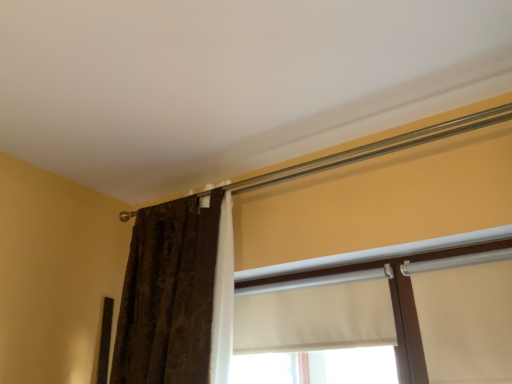
What do you see at coordinates (393, 318) in the screenshot? I see `white fabric at center, the 1th window positioned from the right` at bounding box center [393, 318].

Identify the location of white matte window at center, which is counted as the second window, starting from the right. This screenshot has width=512, height=384. (315, 331).

Locate an element on the screen. The height and width of the screenshot is (384, 512). brown textured curtain at left is located at coordinates (169, 295).

Where is `curtain above the white fabric at center, the 1th window positioned from the right (from the image's perspective)`? This screenshot has width=512, height=384. curtain above the white fabric at center, the 1th window positioned from the right (from the image's perspective) is located at coordinates (169, 295).

From the image's perspective, is white fabric at center, the 1th window positioned from the right, under brown textured curtain at left?

Yes, from the image's perspective, white fabric at center, the 1th window positioned from the right, is beneath brown textured curtain at left.

Which object is thinner, white fabric at center, the 1th window positioned from the right, or brown textured curtain at left?

white fabric at center, the 1th window positioned from the right, is thinner.

Would you say white fabric at center, the second window positioned from the left, contains brown textured curtain at left?

That's incorrect, brown textured curtain at left is not inside white fabric at center, the second window positioned from the left.

From the image's perspective, relative to brown textured curtain at left, is white matte window at center, which is counted as the second window, starting from the right, above or below?

Clearly, from the image's perspective, white matte window at center, which is counted as the second window, starting from the right, is below brown textured curtain at left.

Between white matte window at center, which is counted as the second window, starting from the right, and brown textured curtain at left, which one appears on the right side from the viewer's perspective?

white matte window at center, which is counted as the second window, starting from the right, is more to the right.

Is the depth of white matte window at center, marked as the 1th window in a left-to-right arrangement, greater than that of brown textured curtain at left?

Yes.

How much distance is there between white matte window at center, marked as the 1th window in a left-to-right arrangement, and brown textured curtain at left?

They are 14.05 inches apart.

From a real-world perspective, is white fabric at center, the 1th window positioned from the right, located beneath white matte window at center, marked as the 1th window in a left-to-right arrangement?

Yes, from a real-world perspective, white fabric at center, the 1th window positioned from the right, is beneath white matte window at center, marked as the 1th window in a left-to-right arrangement.

Is white fabric at center, the 1th window positioned from the right, far from white matte window at center, which is counted as the second window, starting from the right?

white fabric at center, the 1th window positioned from the right, is near white matte window at center, which is counted as the second window, starting from the right, not far away.

Which object is closer to the camera taking this photo, white fabric at center, the second window positioned from the left, or white matte window at center, which is counted as the second window, starting from the right?

white fabric at center, the second window positioned from the left, is in front.

Can you tell me how much white fabric at center, the second window positioned from the left, and white matte window at center, marked as the 1th window in a left-to-right arrangement, differ in facing direction?

The angle between the facing direction of white fabric at center, the second window positioned from the left, and the facing direction of white matte window at center, marked as the 1th window in a left-to-right arrangement, is 1.13 degrees.

From a real-world perspective, which is physically below, brown textured curtain at left or white matte window at center, which is counted as the second window, starting from the right?

white matte window at center, which is counted as the second window, starting from the right, is physically lower.

Which object is positioned more to the left, brown textured curtain at left or white matte window at center, which is counted as the second window, starting from the right?

brown textured curtain at left.

Looking at the image, does brown textured curtain at left seem bigger or smaller compared to white matte window at center, which is counted as the second window, starting from the right?

In the image, brown textured curtain at left appears to be larger than white matte window at center, which is counted as the second window, starting from the right.

How much distance is there between brown textured curtain at left and white matte window at center, which is counted as the second window, starting from the right?

brown textured curtain at left is 14.05 inches from white matte window at center, which is counted as the second window, starting from the right.

Considering the positions of points (141, 322) and (500, 260), is point (141, 322) closer to camera compared to point (500, 260)?

No.

Is brown textured curtain at left facing away from white fabric at center, the second window positioned from the left?

brown textured curtain at left does not have its back to white fabric at center, the second window positioned from the left.

Is brown textured curtain at left not inside white fabric at center, the second window positioned from the left?

Absolutely, brown textured curtain at left is external to white fabric at center, the second window positioned from the left.

Looking at this image, measure the distance from brown textured curtain at left to white fabric at center, the 1th window positioned from the right.

Result: The distance of brown textured curtain at left from white fabric at center, the 1th window positioned from the right, is 17.25 inches.

From the image's perspective, which one is positioned lower, white matte window at center, marked as the 1th window in a left-to-right arrangement, or white fabric at center, the 1th window positioned from the right?

white matte window at center, marked as the 1th window in a left-to-right arrangement, from the image's perspective.

Can you see white matte window at center, which is counted as the second window, starting from the right, touching white fabric at center, the second window positioned from the left?

Yes, white matte window at center, which is counted as the second window, starting from the right, and white fabric at center, the second window positioned from the left, clearly make contact.

Is white matte window at center, marked as the 1th window in a left-to-right arrangement, bigger or smaller than white fabric at center, the 1th window positioned from the right?

Clearly, white matte window at center, marked as the 1th window in a left-to-right arrangement, is smaller in size than white fabric at center, the 1th window positioned from the right.

The width and height of the screenshot is (512, 384). Find the location of `curtain behind the white fabric at center, the second window positioned from the left`. curtain behind the white fabric at center, the second window positioned from the left is located at coordinates (169, 295).

At what (x,y) coordinates should I click in order to perform the action: click on the 2nd window positioned below the brown textured curtain at left (from the image's perspective). Please return your answer as a coordinate pair (x, y). Image resolution: width=512 pixels, height=384 pixels. Looking at the image, I should click on (315, 331).

Looking at this image, which object lies nearer to the anchor point white matte window at center, marked as the 1th window in a left-to-right arrangement, brown textured curtain at left or white fabric at center, the second window positioned from the left?

white fabric at center, the second window positioned from the left, is positioned closer to the anchor white matte window at center, marked as the 1th window in a left-to-right arrangement.

Based on their spatial positions, is white matte window at center, which is counted as the second window, starting from the right, or white fabric at center, the 1th window positioned from the right, closer to brown textured curtain at left?

white matte window at center, which is counted as the second window, starting from the right, is positioned closer to the anchor brown textured curtain at left.

Looking at the image, which one is located closer to white fabric at center, the second window positioned from the left, white matte window at center, marked as the 1th window in a left-to-right arrangement, or brown textured curtain at left?

Among the two, white matte window at center, marked as the 1th window in a left-to-right arrangement, is located nearer to white fabric at center, the second window positioned from the left.

From the image, which object appears to be nearer to white matte window at center, marked as the 1th window in a left-to-right arrangement, white fabric at center, the 1th window positioned from the right, or brown textured curtain at left?

white fabric at center, the 1th window positioned from the right, lies closer to white matte window at center, marked as the 1th window in a left-to-right arrangement, than the other object.

Which object lies further to the anchor point brown textured curtain at left, white fabric at center, the second window positioned from the left, or white matte window at center, marked as the 1th window in a left-to-right arrangement?

Among the two, white fabric at center, the second window positioned from the left, is located further to brown textured curtain at left.

Which object lies further to the anchor point white fabric at center, the second window positioned from the left, brown textured curtain at left or white matte window at center, marked as the 1th window in a left-to-right arrangement?

Among the two, brown textured curtain at left is located further to white fabric at center, the second window positioned from the left.

Image resolution: width=512 pixels, height=384 pixels. Find the location of `window between brown textured curtain at left and white fabric at center, the second window positioned from the left`. window between brown textured curtain at left and white fabric at center, the second window positioned from the left is located at coordinates (315, 331).